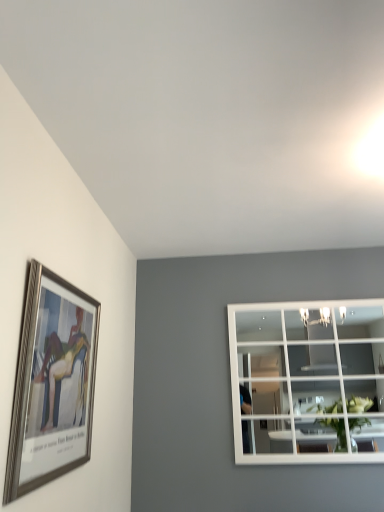
Describe the element at coordinates (52, 383) in the screenshot. This screenshot has width=384, height=512. I see `silver metallic picture frame at left` at that location.

Looking at this image, in order to face silver metallic picture frame at left, should I rotate leftwards or rightwards?

Turn left by 16.091 degrees to look at silver metallic picture frame at left.

Locate an element on the screen. This screenshot has width=384, height=512. silver metallic picture frame at left is located at coordinates (52, 383).

The image size is (384, 512). I want to click on silver metallic picture frame at left, so click(x=52, y=383).